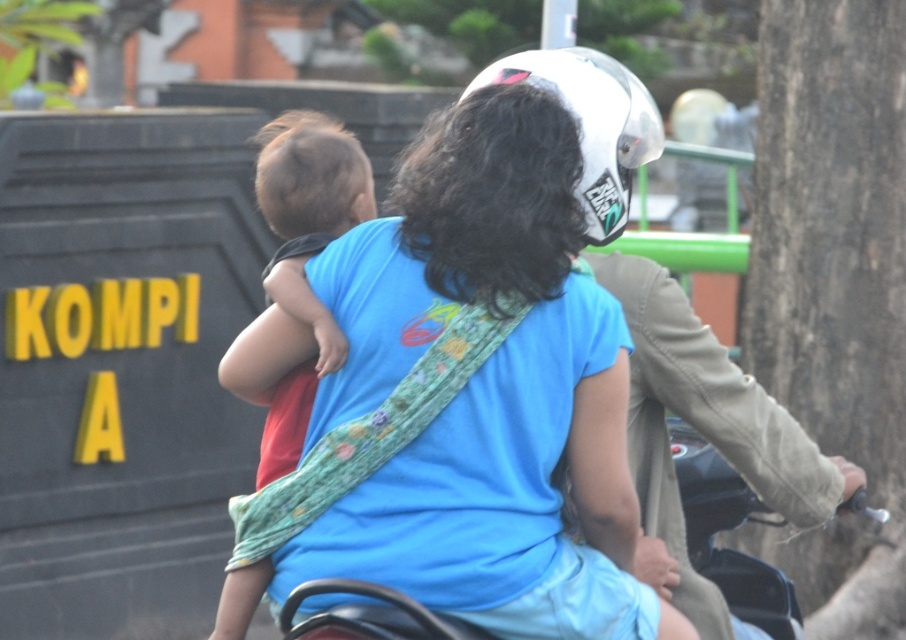
Question: Where is light brown hair at upper left located in relation to white matte helmet at upper center in the image?

Choices:
 (A) above
 (B) below

Answer: (B)

Question: Which of the following is the farthest from the observer?

Choices:
 (A) black matte motorcycle at center
 (B) white matte helmet at upper center
 (C) green leafy tree at upper center
 (D) blue fabric shirt at center

Answer: (C)

Question: Estimate the real-world distances between objects in this image. Which object is closer to the light brown hair at upper left?

Choices:
 (A) black matte motorcycle at center
 (B) white matte helmet at upper center
 (C) blue fabric shirt at center

Answer: (C)

Question: Can you confirm if blue fabric shirt at center is positioned to the left of black matte motorcycle at center?

Choices:
 (A) no
 (B) yes

Answer: (B)

Question: Is blue fabric shirt at center further to the viewer compared to light brown hair at upper left?

Choices:
 (A) yes
 (B) no

Answer: (B)

Question: Which of the following is the closest to the observer?

Choices:
 (A) (603, 26)
 (B) (768, 10)
 (C) (307, 161)

Answer: (C)